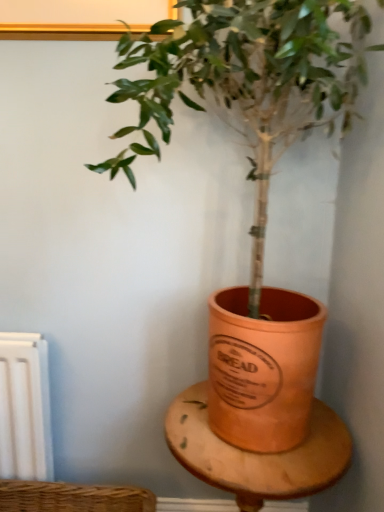
I want to click on terracotta pot at center, so click(x=252, y=172).

What do you see at coordinates (252, 172) in the screenshot? I see `terracotta pot at center` at bounding box center [252, 172].

What is the approximate height of wooden table at center?

15.61 inches.

The image size is (384, 512). I want to click on wooden table at center, so point(257,454).

What is the approximate width of wooden table at center?

wooden table at center is 14.13 inches wide.

The width and height of the screenshot is (384, 512). What do you see at coordinates (257, 454) in the screenshot?
I see `wooden table at center` at bounding box center [257, 454].

Where is `terracotta pot at center`? The width and height of the screenshot is (384, 512). terracotta pot at center is located at coordinates [x=252, y=172].

In the image, is terracotta pot at center on the left side or the right side of wooden table at center?

terracotta pot at center is to the left of wooden table at center.

From the picture: Between terracotta pot at center and wooden table at center, which one is positioned in front?

terracotta pot at center is in front.

Considering the positions of point (351, 93) and point (207, 407), is point (351, 93) closer or farther from the camera than point (207, 407)?

Point (351, 93) is positioned closer to the camera compared to point (207, 407).

From the image's perspective, is terracotta pot at center located above or below wooden table at center?

Clearly, from the image's perspective, terracotta pot at center is above wooden table at center.

From a real-world perspective, relative to wooden table at center, is terracotta pot at center vertically above or below?

terracotta pot at center is above wooden table at center.

Consider the image. Can you confirm if terracotta pot at center is wider than wooden table at center?

Correct, the width of terracotta pot at center exceeds that of wooden table at center.

Who is shorter, terracotta pot at center or wooden table at center?

wooden table at center is shorter.

Is terracotta pot at center bigger than wooden table at center?

Yes, terracotta pot at center is bigger than wooden table at center.

Can we say terracotta pot at center lies outside wooden table at center?

Indeed, terracotta pot at center is completely outside wooden table at center.

Are terracotta pot at center and wooden table at center making contact?

There is a gap between terracotta pot at center and wooden table at center.

Is wooden table at center at the back of terracotta pot at center?

No, terracotta pot at center is not facing away from wooden table at center.

How many degrees apart are the facing directions of terracotta pot at center and wooden table at center?

0.283 degrees.

How much distance is there between terracotta pot at center and wooden table at center?

terracotta pot at center is 12.71 inches away from wooden table at center.

The image size is (384, 512). I want to click on table behind the terracotta pot at center, so click(257, 454).

Between wooden table at center and terracotta pot at center, which one appears on the left side from the viewer's perspective?

Positioned to the left is terracotta pot at center.

Is the position of wooden table at center less distant than that of terracotta pot at center?

That is False.

Is point (221, 469) behind point (260, 349)?

That is False.

From the image's perspective, is wooden table at center positioned above or below terracotta pot at center?

Clearly, from the image's perspective, wooden table at center is below terracotta pot at center.

From a real-world perspective, between wooden table at center and terracotta pot at center, who is vertically lower?

wooden table at center.

Looking at their sizes, would you say wooden table at center is wider or thinner than terracotta pot at center?

Considering their sizes, wooden table at center looks slimmer than terracotta pot at center.

Who is shorter, wooden table at center or terracotta pot at center?

wooden table at center is shorter.

In the scene shown: Does wooden table at center have a larger size compared to terracotta pot at center?

Actually, wooden table at center might be smaller than terracotta pot at center.

Which is correct: wooden table at center is inside terracotta pot at center, or outside of it?

The correct answer is: outside.

Are wooden table at center and terracotta pot at center making contact?

wooden table at center is not next to terracotta pot at center, and they're not touching.

Is wooden table at center oriented away from terracotta pot at center?

No, wooden table at center's orientation is not away from terracotta pot at center.

How many degrees apart are the facing directions of wooden table at center and terracotta pot at center?

There is a 0.283-degree angle between the facing directions of wooden table at center and terracotta pot at center.

Where is `houseplant located on the left of wooden table at center`? houseplant located on the left of wooden table at center is located at coordinates (252, 172).

There is a wooden table at center. Where is `houseplant above it (from a real-world perspective)`? houseplant above it (from a real-world perspective) is located at coordinates (252, 172).

Find the location of a particular element. Image resolution: width=384 pixels, height=512 pixels. houseplant on the left of wooden table at center is located at coordinates (252, 172).